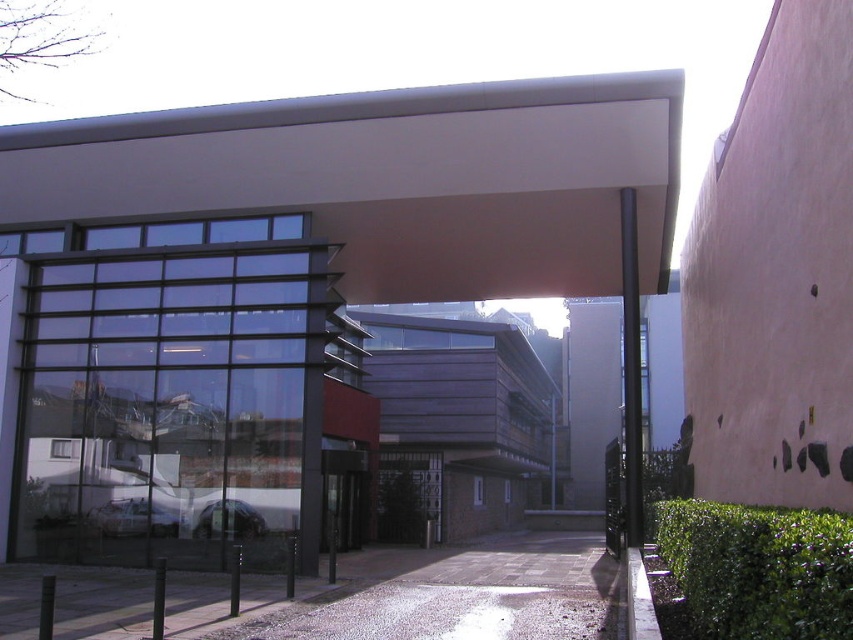
Question: Based on their relative distances, which object is farther from the black glass door at center?

Choices:
 (A) shiny silver car at center
 (B) metallic silver car at center

Answer: (B)

Question: Is black glass door at center wider than metallic silver car at center?

Choices:
 (A) no
 (B) yes

Answer: (A)

Question: Observing the image, what is the correct spatial positioning of metallic silver car at center in reference to shiny silver car at center?

Choices:
 (A) below
 (B) above

Answer: (A)

Question: Among these points, which one is farthest from the camera?

Choices:
 (A) (231, 518)
 (B) (341, 488)
 (C) (129, 522)

Answer: (B)

Question: Where is metallic silver car at center located in relation to shiny silver car at center in the image?

Choices:
 (A) left
 (B) right

Answer: (A)

Question: Which of the following is the closest to the observer?

Choices:
 (A) (165, 509)
 (B) (343, 525)

Answer: (A)